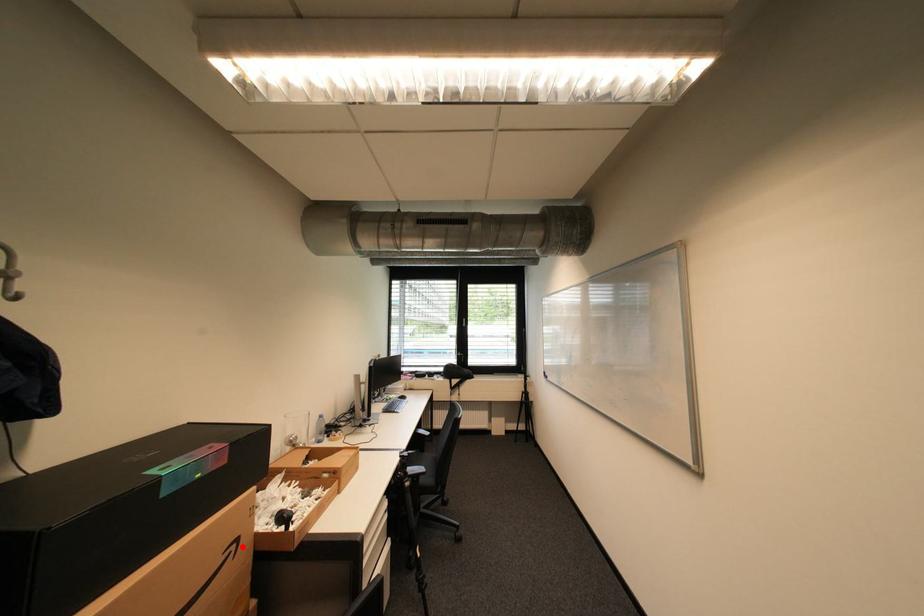
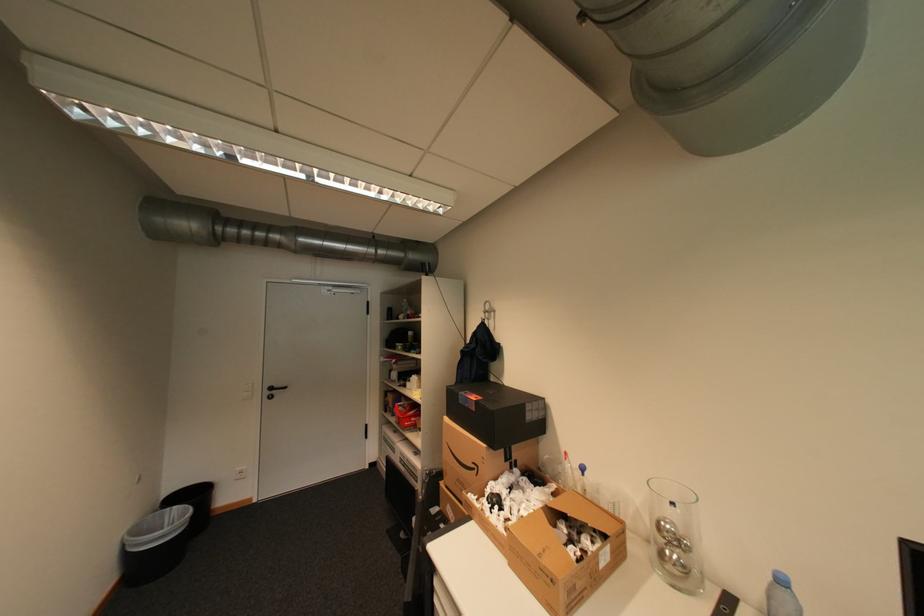
The point at the highlighted location is marked in the first image. Where is the corresponding point in the second image?

(484, 468)